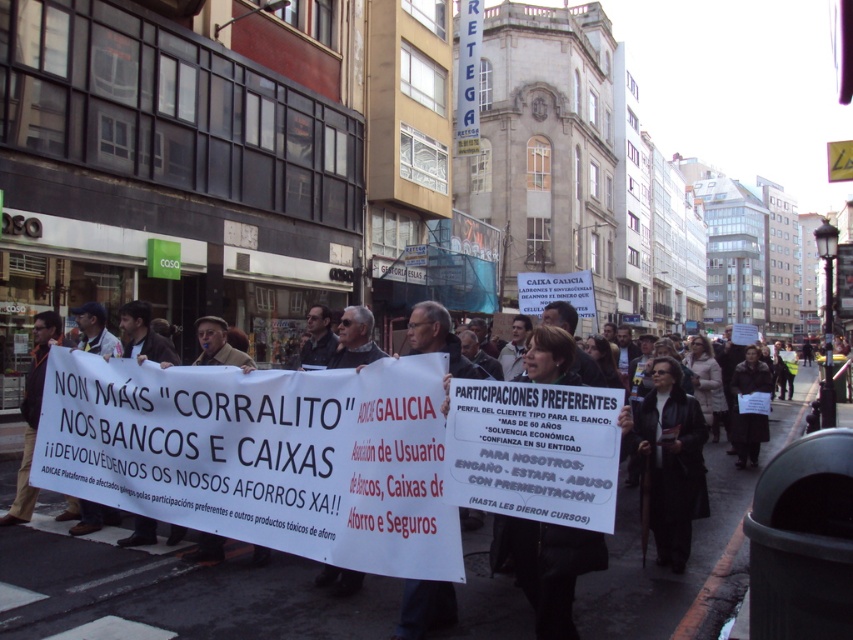
Question: Is white paper sign at center thinner than dark brown leather jacket at lower left?

Choices:
 (A) yes
 (B) no

Answer: (B)

Question: Does white paper sign at center have a greater width compared to black leather coat at center?

Choices:
 (A) yes
 (B) no

Answer: (A)

Question: Considering the real-world distances, which object is closest to the dark brown leather jacket at lower left?

Choices:
 (A) black leather coat at center
 (B) white paper sign at center

Answer: (B)

Question: Based on their relative distances, which object is farther from the white paper sign at center?

Choices:
 (A) dark brown leather jacket at lower left
 (B) black leather coat at center

Answer: (A)

Question: Does black leather coat at center have a greater width compared to dark brown leather jacket at lower left?

Choices:
 (A) no
 (B) yes

Answer: (B)

Question: Based on their relative distances, which object is farther from the black leather coat at center?

Choices:
 (A) dark brown leather jacket at lower left
 (B) white paper sign at center

Answer: (A)